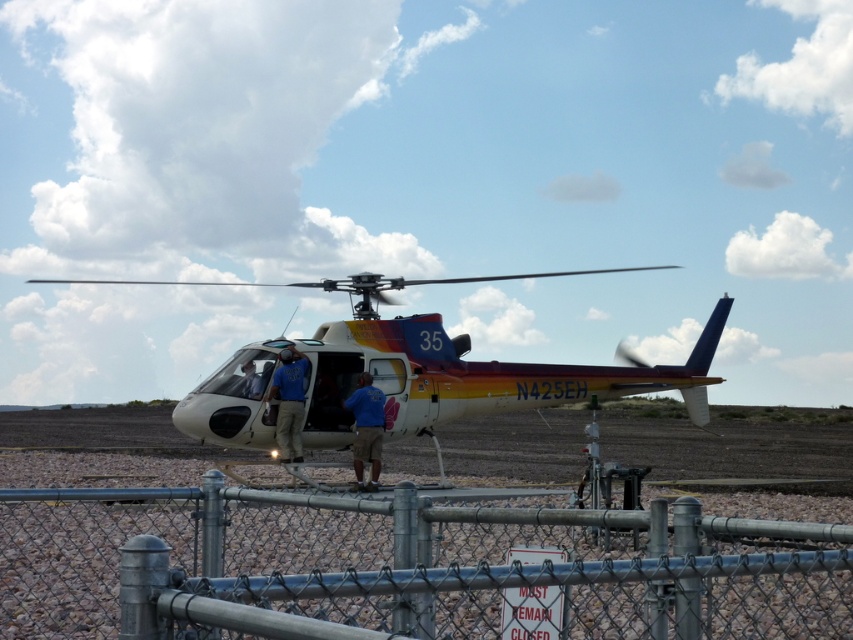
Can you confirm if white glossy helicopter at center is positioned to the left of blue fabric shirt at center?

Incorrect, white glossy helicopter at center is not on the left side of blue fabric shirt at center.

Who is positioned more to the left, white glossy helicopter at center or blue fabric shirt at center?

blue fabric shirt at center is more to the left.

This screenshot has width=853, height=640. Identify the location of white glossy helicopter at center. (415, 371).

Can you confirm if blue fabric shirt at center is taller than blue cotton shirt at center?

Incorrect, blue fabric shirt at center's height is not larger of blue cotton shirt at center's.

Between blue fabric shirt at center and blue cotton shirt at center, which one has more height?

Standing taller between the two is blue cotton shirt at center.

Between point (289, 355) and point (370, 460), which one is positioned in front?

Point (289, 355) is in front.

Locate an element on the screen. The width and height of the screenshot is (853, 640). blue fabric shirt at center is located at coordinates (289, 403).

Does metal chain-link fence at lower center have a smaller size compared to white glossy helicopter at center?

Correct, metal chain-link fence at lower center occupies less space than white glossy helicopter at center.

Which is more to the right, metal chain-link fence at lower center or white glossy helicopter at center?

metal chain-link fence at lower center

Which is in front, point (157, 486) or point (722, 324)?

Point (157, 486) is in front.

Locate an element on the screen. This screenshot has height=640, width=853. metal chain-link fence at lower center is located at coordinates (404, 566).